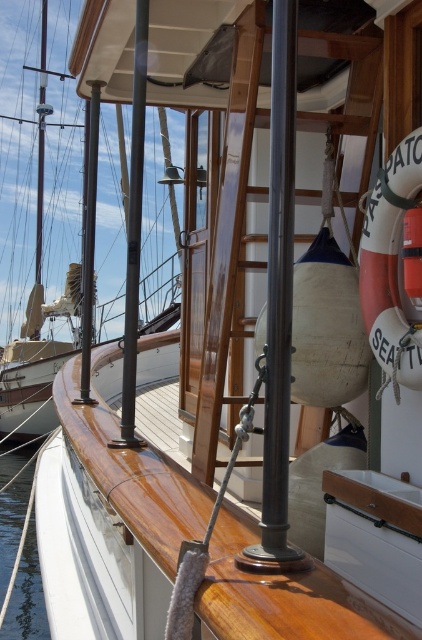
Measure the distance between polished dark wood pole at center and camera.

polished dark wood pole at center and camera are 8.31 feet apart from each other.

Can you confirm if polished dark wood pole at center is positioned to the left of transparent water at lower left?

In fact, polished dark wood pole at center is to the right of transparent water at lower left.

Which is behind, point (132, 248) or point (5, 552)?

The point (5, 552) is more distant.

Where is `polished dark wood pole at center`? This screenshot has height=640, width=422. polished dark wood pole at center is located at coordinates (134, 232).